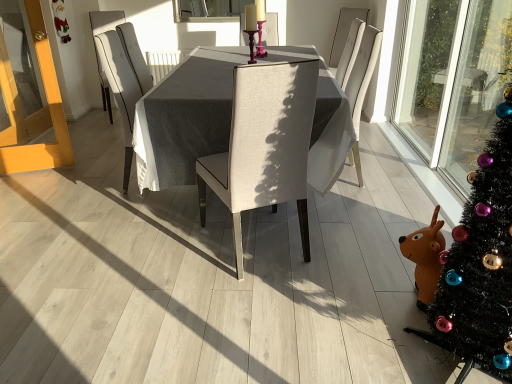
Question: Does beige fabric chair at center, the first chair from the front, have a lesser width compared to light wood screen door at left?

Choices:
 (A) no
 (B) yes

Answer: (A)

Question: Does beige fabric chair at center, the second chair viewed from the left, appear on the right side of light wood screen door at left?

Choices:
 (A) yes
 (B) no

Answer: (A)

Question: Is beige fabric chair at center, the first chair from the front, positioned with its back to light wood screen door at left?

Choices:
 (A) yes
 (B) no

Answer: (B)

Question: Can we say beige fabric chair at center, which is counted as the 3th chair, starting from the back, lies outside light wood screen door at left?

Choices:
 (A) yes
 (B) no

Answer: (A)

Question: From the image's perspective, is beige fabric chair at center, the first chair from the front, over light wood screen door at left?

Choices:
 (A) yes
 (B) no

Answer: (B)

Question: Considering the relative sizes of beige fabric chair at center, the first chair from the front, and light wood screen door at left in the image provided, is beige fabric chair at center, the first chair from the front, shorter than light wood screen door at left?

Choices:
 (A) no
 (B) yes

Answer: (B)

Question: Is light wood screen door at left a part of textured gray table at center?

Choices:
 (A) yes
 (B) no

Answer: (B)

Question: Is textured gray table at center turned away from light wood screen door at left?

Choices:
 (A) yes
 (B) no

Answer: (B)

Question: Is textured gray table at center thinner than light wood screen door at left?

Choices:
 (A) no
 (B) yes

Answer: (A)

Question: Is textured gray table at center not inside light wood screen door at left?

Choices:
 (A) no
 (B) yes

Answer: (B)

Question: Is textured gray table at center at the left side of light wood screen door at left?

Choices:
 (A) no
 (B) yes

Answer: (A)

Question: Does textured gray table at center have a greater width compared to light wood screen door at left?

Choices:
 (A) no
 (B) yes

Answer: (B)

Question: Is clear glass window screen at upper center located outside light wood screen door at left?

Choices:
 (A) no
 (B) yes

Answer: (B)